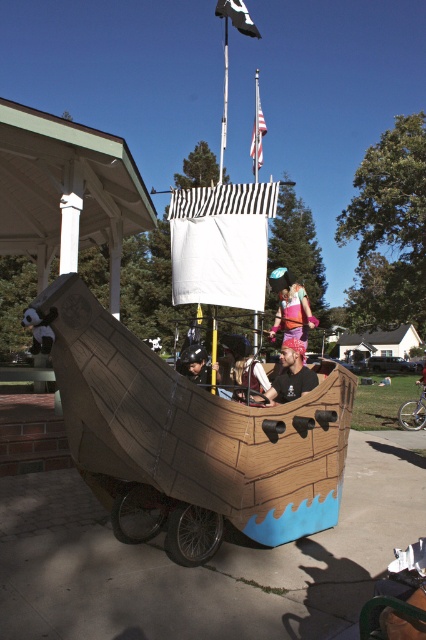
Question: Can you confirm if white fabric flag at center is positioned above matte black helmet at center?

Choices:
 (A) no
 (B) yes

Answer: (B)

Question: Which point is closer to the camera taking this photo?

Choices:
 (A) (296, 349)
 (B) (184, 362)
 (C) (255, 170)

Answer: (A)

Question: Considering the real-world distances, which object is closest to the black fabric flag at upper center?

Choices:
 (A) matte black helmet at center
 (B) white fabric flag at upper center
 (C) pink fabric dress at center

Answer: (C)

Question: Can you confirm if white fabric flag at center is positioned above pink fabric dress at center?

Choices:
 (A) yes
 (B) no

Answer: (A)

Question: Can you confirm if matte black helmet at center is positioned to the right of white fabric flag at upper center?

Choices:
 (A) yes
 (B) no

Answer: (B)

Question: Which object is closer to the camera taking this photo?

Choices:
 (A) matte black shirt at center
 (B) white fabric flag at center
 (C) matte black helmet at center
 (D) pink fabric dress at center

Answer: (B)